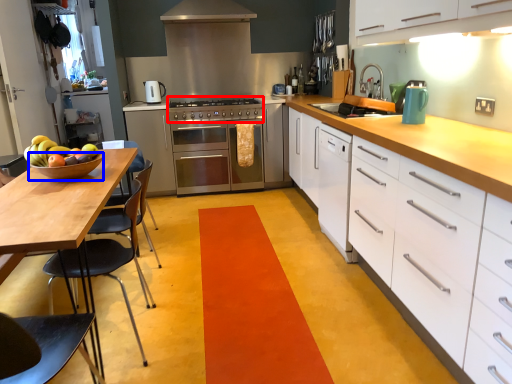
Question: Among these objects, which one is nearest to the camera, gas stove (highlighted by a red box) or bowl (highlighted by a blue box)?

Choices:
 (A) gas stove
 (B) bowl

Answer: (B)